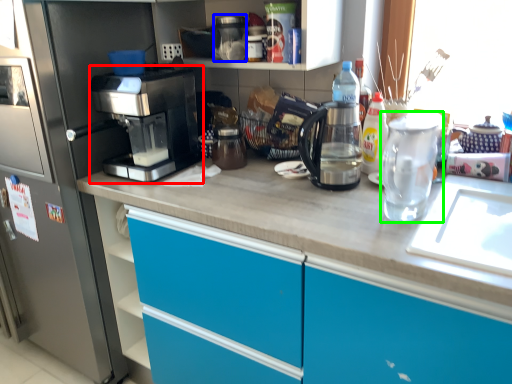
Question: Which object is the farthest from coffee maker (highlighted by a red box)? Choose among these: appliance (highlighted by a blue box) or tea pot (highlighted by a green box).

Choices:
 (A) appliance
 (B) tea pot

Answer: (B)